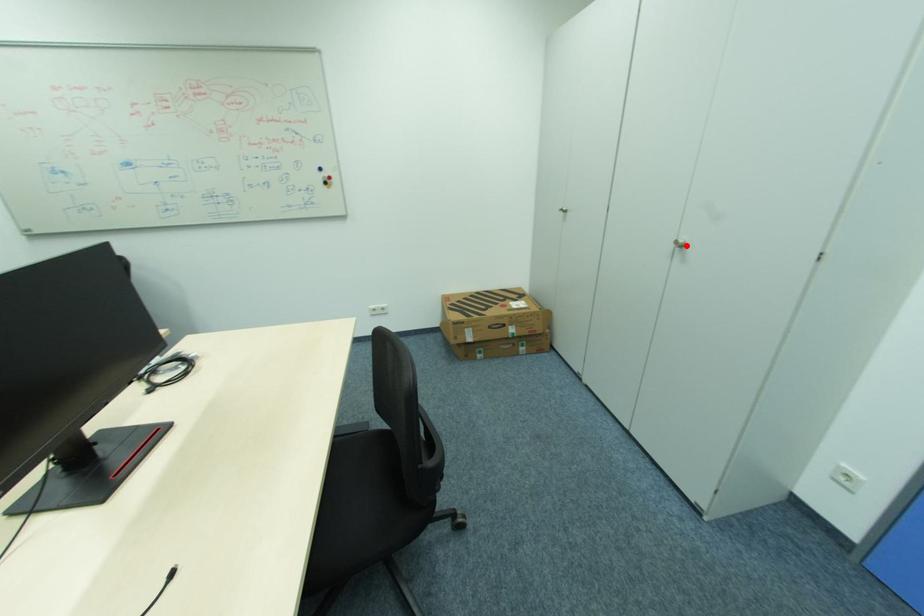
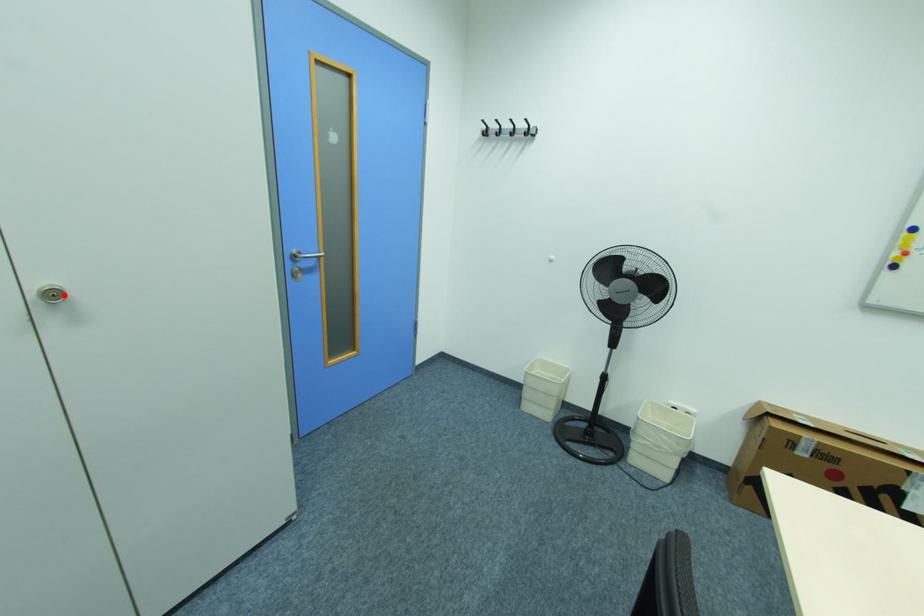
I am providing you with two images of the same scene from different viewpoints. A red point is marked on the first image and another point is marked on the second image. Does the point marked in image1 correspond to the same location as the one in image2?

Yes